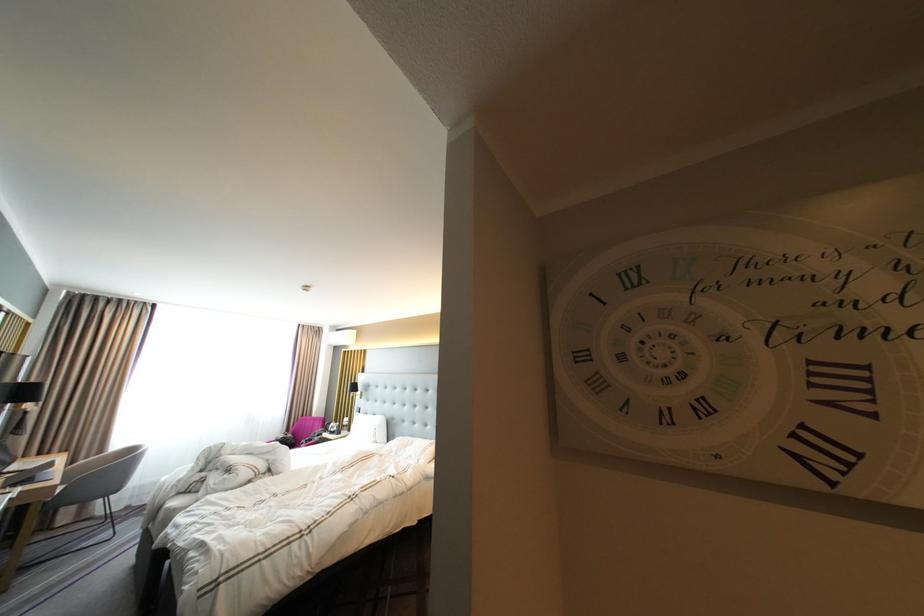
The height and width of the screenshot is (616, 924). Find the location of `laptop computer`. laptop computer is located at coordinates (26, 472).